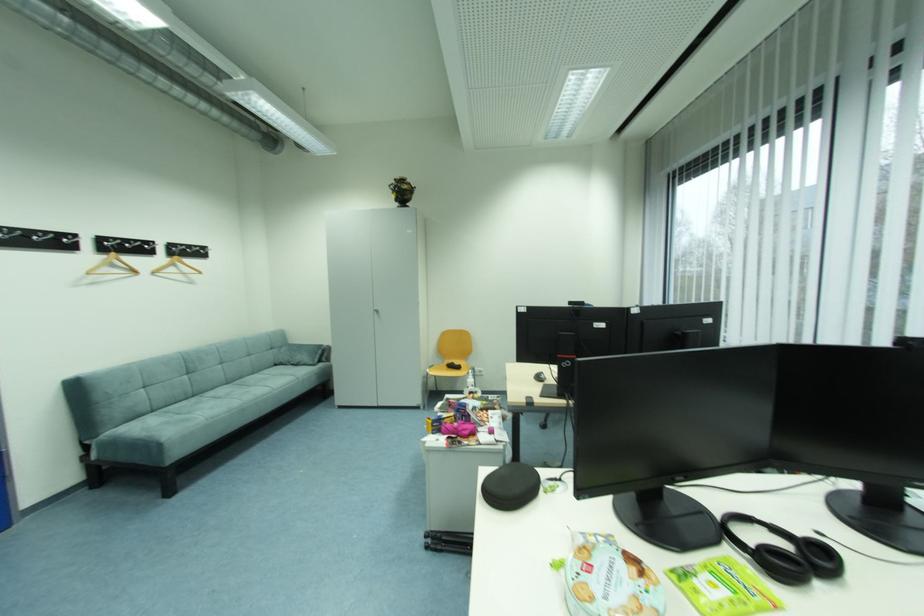
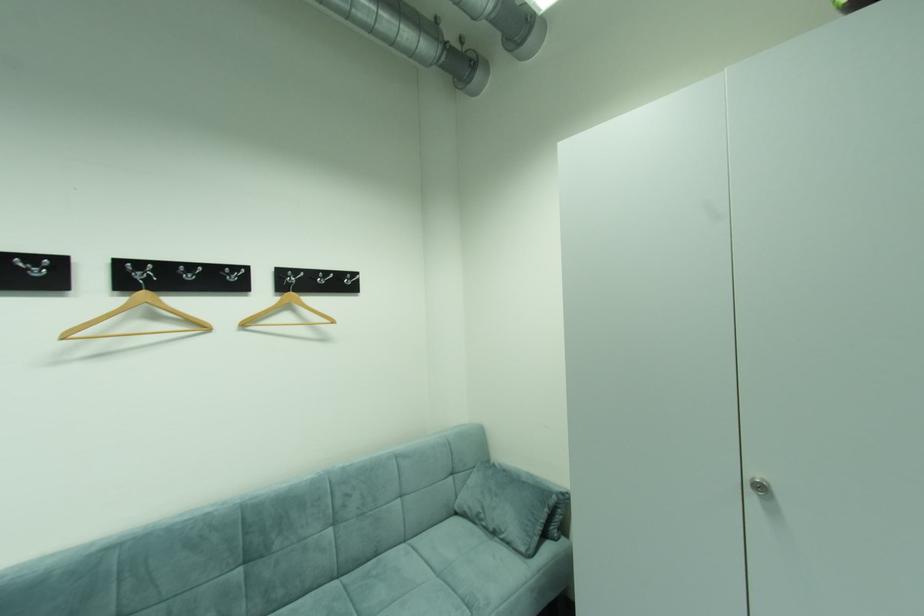
The point at (x=120, y=254) is marked in the first image. Where is the corresponding point in the second image?

(150, 294)